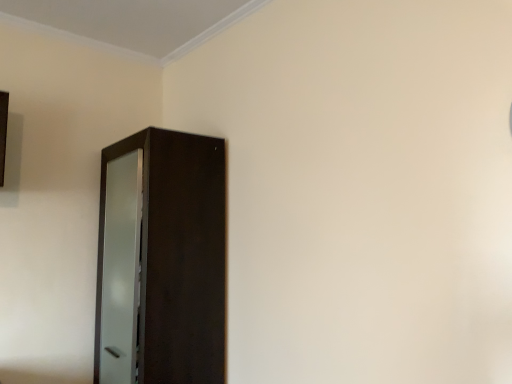
What do you see at coordinates (161, 260) in the screenshot?
I see `dark wood cabinet at center` at bounding box center [161, 260].

Locate an element on the screen. This screenshot has width=512, height=384. dark wood cabinet at center is located at coordinates (161, 260).

Measure the distance between point (109,329) and camera.

Point (109,329) is 6.62 feet away from camera.

Locate an element on the screen. The width and height of the screenshot is (512, 384). dark wood cabinet at center is located at coordinates (161, 260).